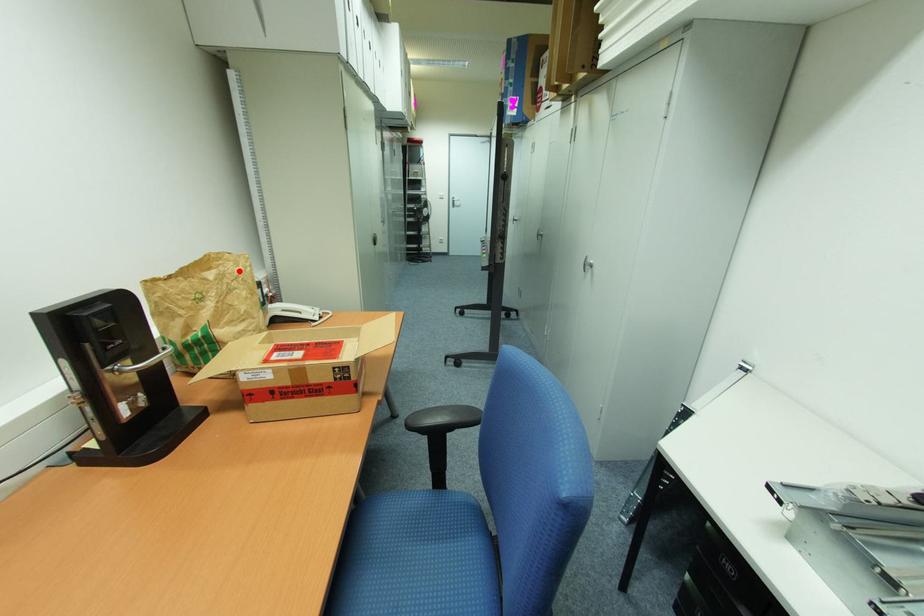
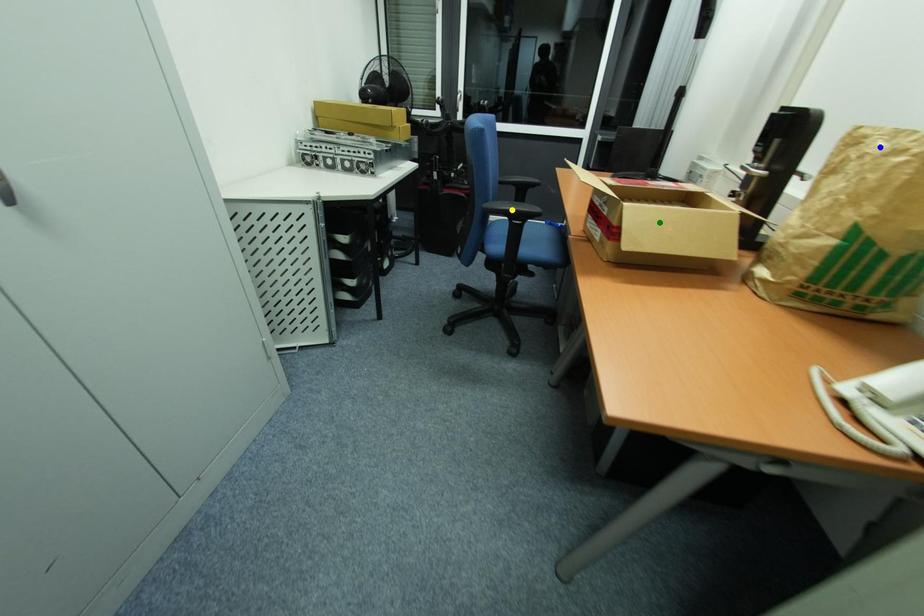
Question: I am providing you with two images of the same scene from different viewpoints. A red point is marked on the first image. You are given multiple points on the second image. Which point in image 2 represents the same 3d spot as the red point in image 1?

Choices:
 (A) green point
 (B) blue point
 (C) yellow point

Answer: (B)